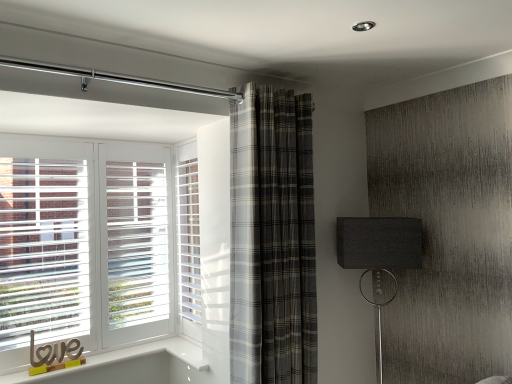
Question: Considering the positions of point (284, 167) and point (185, 268), is point (284, 167) closer or farther from the camera than point (185, 268)?

Choices:
 (A) closer
 (B) farther

Answer: (A)

Question: Would you say plaid fabric curtain at center is to the left or to the right of white textured screen door at center in the picture?

Choices:
 (A) left
 (B) right

Answer: (B)

Question: Which of these objects is positioned farthest from the white textured screen door at center?

Choices:
 (A) plaid fabric curtain at center
 (B) matte black lampshade at right

Answer: (B)

Question: Estimate the real-world distances between objects in this image. Which object is closer to the matte black lampshade at right?

Choices:
 (A) plaid fabric curtain at center
 (B) white textured screen door at center

Answer: (A)